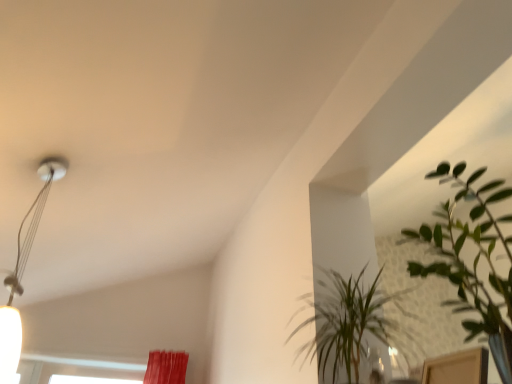
Question: Considering the positions of green leafy plant at upper right, acting as the second houseplant starting from the front, and metallic silver lamp at upper left in the image, is green leafy plant at upper right, acting as the second houseplant starting from the front, bigger or smaller than metallic silver lamp at upper left?

Choices:
 (A) small
 (B) big

Answer: (B)

Question: In the image, is green leafy plant at upper right, the 1th houseplant in the back-to-front sequence, positioned in front of or behind metallic silver lamp at upper left?

Choices:
 (A) front
 (B) behind

Answer: (A)

Question: Considering the real-world distances, which object is farthest from the green leafy plant at upper right, the 2th houseplant viewed from the back?

Choices:
 (A) metallic silver lamp at upper left
 (B) green leafy plant at upper right, the 1th houseplant in the back-to-front sequence

Answer: (A)

Question: Which object is positioned closest to the green leafy plant at upper right, the 1th houseplant in the back-to-front sequence?

Choices:
 (A) metallic silver lamp at upper left
 (B) green leafy plant at upper right, the first houseplant in the front-to-back sequence

Answer: (B)